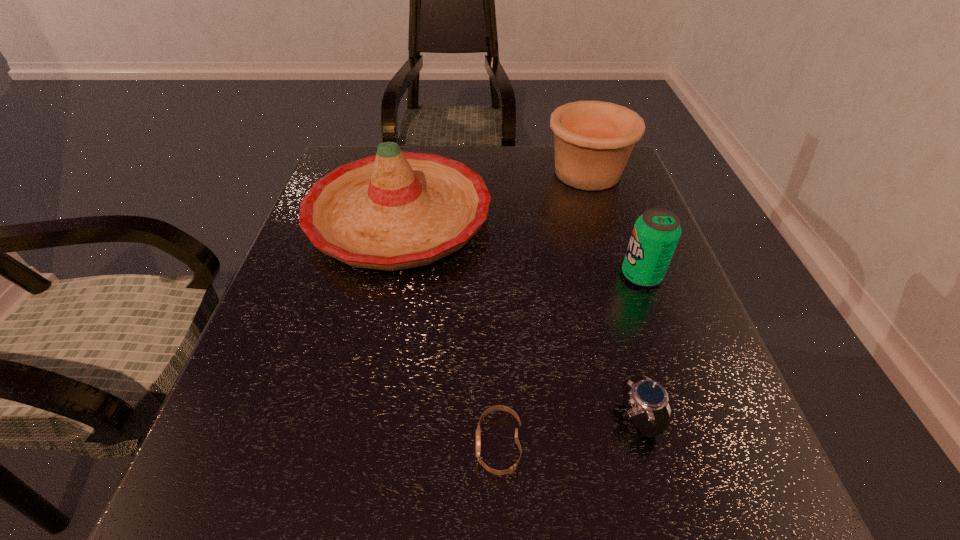
Locate an element on the screen. free space between the sombrero and the second shortest object is located at coordinates (518, 318).

The height and width of the screenshot is (540, 960). I want to click on vacant area that lies between the left watch and the taller watch, so (567, 431).

Point out which object is positioned as the third nearest to the shortest object. Please provide its 2D coordinates. Your answer should be formatted as a tuple, i.e. [(x, y)], where the tuple contains the x and y coordinates of a point satisfying the conditions above.

[(656, 233)]

The height and width of the screenshot is (540, 960). Identify the location of the fourth closest object to the pottery. pos(478,431).

You are a GUI agent. You are given a task and a screenshot of the screen. Output one action in this format:
    pyautogui.click(x=<x>, y=<y>)
    Task: Click on the free location that satisfies the following two spatial constraints: 1. on the front side of the pottery; 2. on the face of the left watch
    
    Given the screenshot: What is the action you would take?
    pyautogui.click(x=674, y=444)